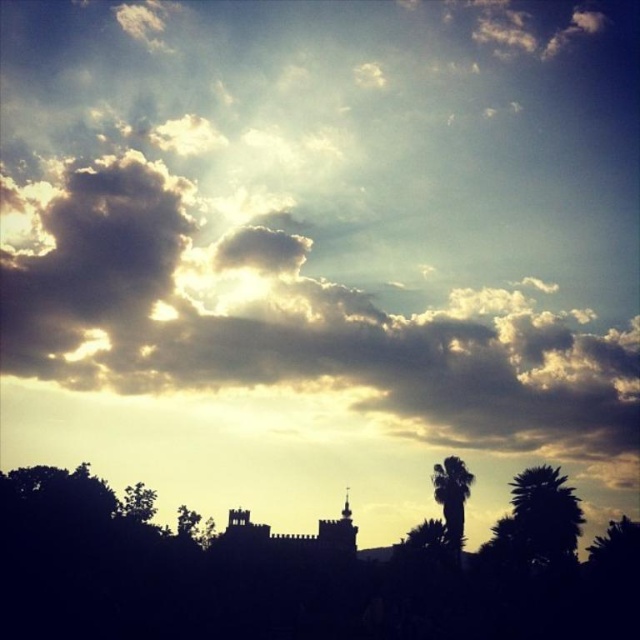
Does green leafy palm tree at right appear on the right side of green leafy palm tree at center-right?

Correct, you'll find green leafy palm tree at right to the right of green leafy palm tree at center-right.

Does point (548, 493) come closer to viewer compared to point (456, 508)?

Yes, point (548, 493) is in front of point (456, 508).

I want to click on green leafy palm tree at right, so click(x=545, y=515).